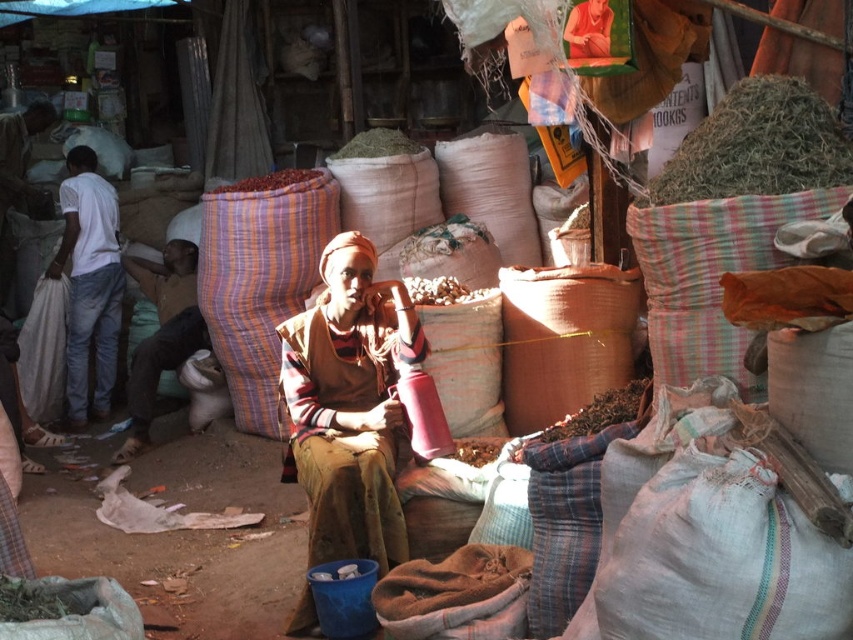
Which is above, brown grain at center or brown crumbly food at center?

brown grain at center is higher up.

Is point (433, 298) positioned after point (488, 461)?

Yes, point (433, 298) is farther from viewer.

Where is `brown grain at center`? This screenshot has height=640, width=853. brown grain at center is located at coordinates (440, 291).

Consider the image. Does brown woven cloth at center appear on the right side of brown woven fabric at left?

Indeed, brown woven cloth at center is positioned on the right side of brown woven fabric at left.

Does brown woven cloth at center have a greater width compared to brown woven fabric at left?

No, brown woven cloth at center is not wider than brown woven fabric at left.

Image resolution: width=853 pixels, height=640 pixels. What do you see at coordinates (349, 404) in the screenshot?
I see `brown woven cloth at center` at bounding box center [349, 404].

What are the coordinates of `brown woven cloth at center` in the screenshot? It's located at (349, 404).

Can you confirm if white cotton shirt at left is wider than brown grain at center?

Correct, the width of white cotton shirt at left exceeds that of brown grain at center.

Is point (77, 336) more distant than point (403, 282)?

Yes, point (77, 336) is behind point (403, 282).

Identify the location of white cotton shirt at left. Image resolution: width=853 pixels, height=640 pixels. (90, 284).